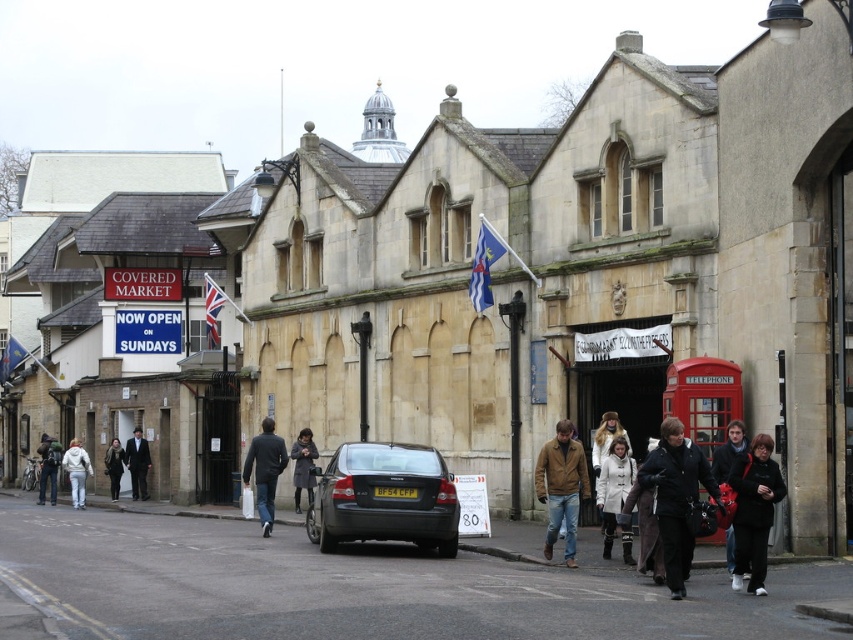
You are a photographer standing in front of the historic building and want to take a photo of both the dark blue jacket at center and the white fleece jacket at center. However, you notice that one of them is blocking the other. Which jacket is blocking the other?

The dark blue jacket at center is blocking the white fleece jacket at center because it is positioned in front of it.

You are a fashion designer observing jackets displayed in a historic market. You see a black leather jacket at lower right and a dark blue jacket at center. Which jacket has a shorter length?

The black leather jacket at lower right is shorter than the dark blue jacket at center.